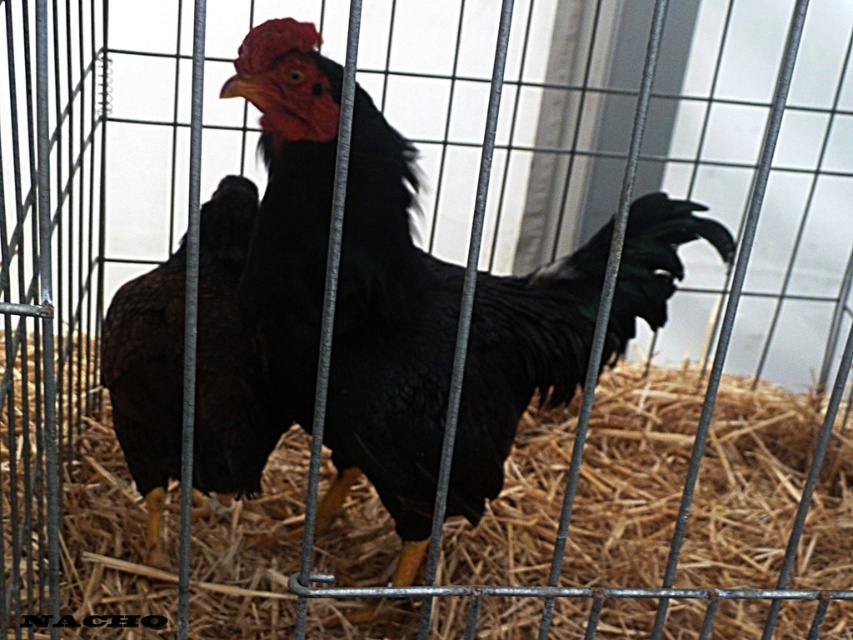
Question: Which object is closer to the camera taking this photo?

Choices:
 (A) brown feathered chicken at center
 (B) brown straw at center

Answer: (B)

Question: Which point appears farthest from the camera in this image?

Choices:
 (A) (134, 384)
 (B) (62, 595)
 (C) (334, 365)

Answer: (B)

Question: Is brown straw at center below shiny black rooster at center?

Choices:
 (A) yes
 (B) no

Answer: (A)

Question: Estimate the real-world distances between objects in this image. Which object is closer to the shiny black rooster at center?

Choices:
 (A) brown straw at center
 (B) brown feathered chicken at center

Answer: (B)

Question: From the image, what is the correct spatial relationship of brown straw at center in relation to shiny black rooster at center?

Choices:
 (A) above
 (B) below

Answer: (B)

Question: Can you confirm if brown straw at center is wider than shiny black rooster at center?

Choices:
 (A) yes
 (B) no

Answer: (A)